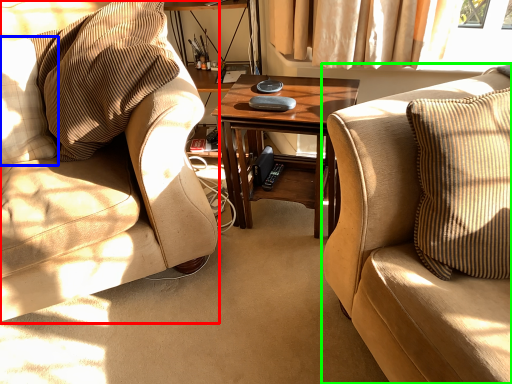
Question: Which object is the farthest from chair (highlighted by a red box)? Choose among these: pillow (highlighted by a blue box) or studio couch (highlighted by a green box).

Choices:
 (A) pillow
 (B) studio couch

Answer: (B)